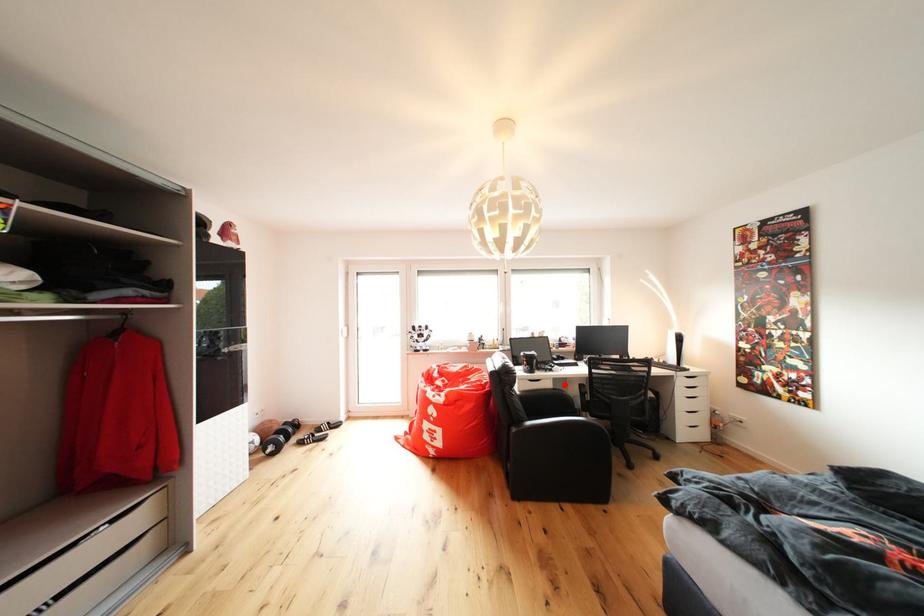
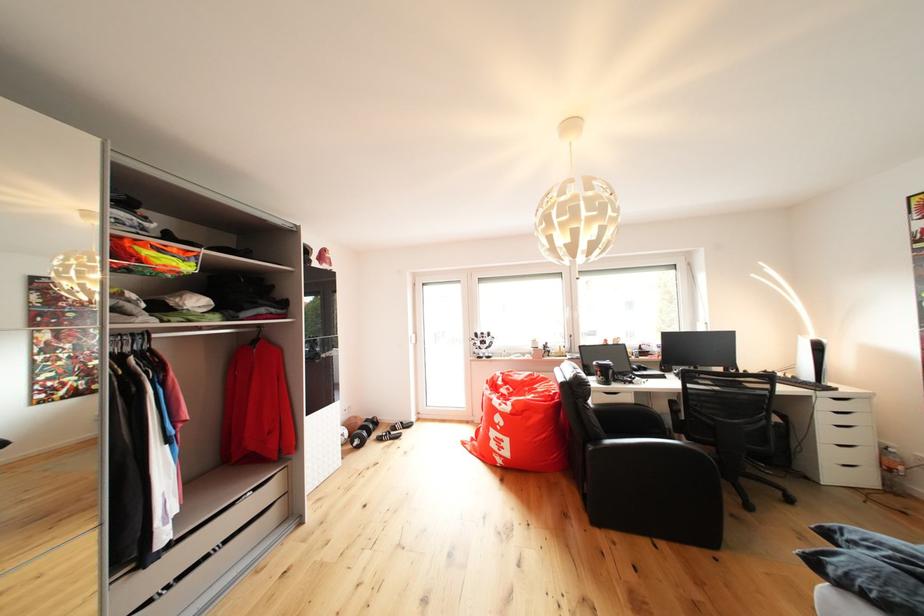
Locate, in the second image, the point that corresponds to the highlighted location in the first image.

(647, 399)